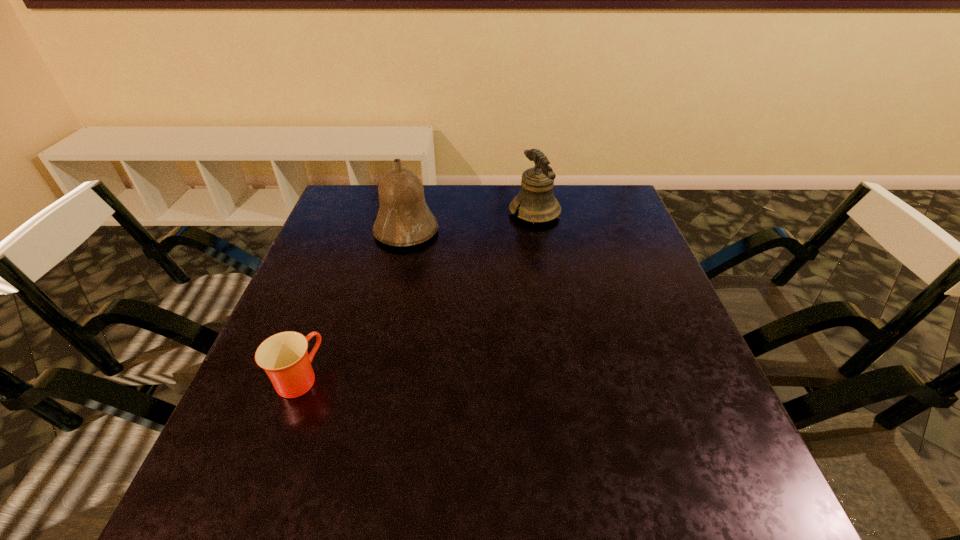
Where is `free space at the far edge of the desktop`? free space at the far edge of the desktop is located at coordinates (543, 227).

Locate an element on the screen. free space at the left edge of the desktop is located at coordinates (331, 330).

This screenshot has height=540, width=960. In order to click on vacant space at the right edge of the desktop in this screenshot , I will do `click(649, 394)`.

Identify the location of vacant space at the near left corner of the desktop. (287, 500).

In the image, there is a desktop. Identify the location of vacant space at the far right corner. (610, 210).

The width and height of the screenshot is (960, 540). Identify the location of free space at the near right corner of the desktop. (677, 522).

Identify the location of free spot between the right bell and the second object from right to left. (470, 222).

This screenshot has width=960, height=540. I want to click on vacant space in between the rightmost object and the cup, so click(x=417, y=295).

You are a GUI agent. You are given a task and a screenshot of the screen. Output one action in this format:
    pyautogui.click(x=<x>, y=<y>)
    Task: Click on the empty location between the left bell and the shortest object
    
    Given the screenshot: What is the action you would take?
    pyautogui.click(x=352, y=305)

Identify the location of free space between the rightmost object and the cup. [417, 295].